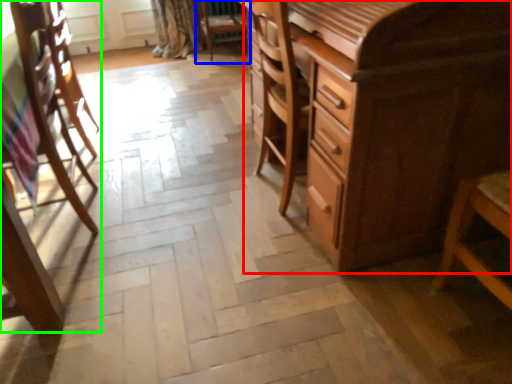
Question: Which object is the farthest from chest of drawers (highlighted by a red box)? Choose among these: chair (highlighted by a blue box) or chair (highlighted by a green box).

Choices:
 (A) chair
 (B) chair

Answer: (A)